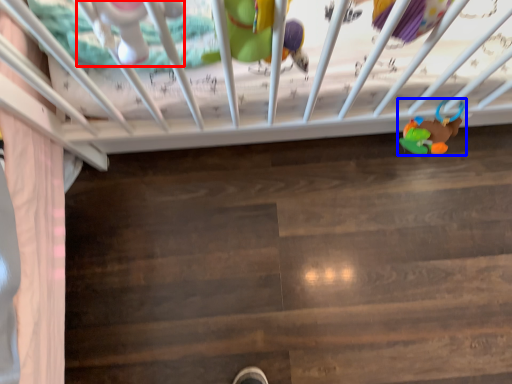
Question: Among these objects, which one is farthest to the camera, toy (highlighted by a red box) or toy (highlighted by a blue box)?

Choices:
 (A) toy
 (B) toy

Answer: (B)